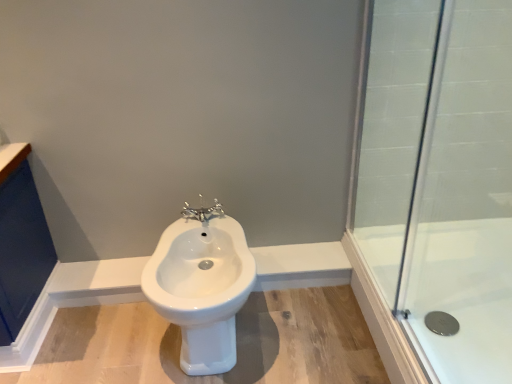
You are a GUI agent. You are given a task and a screenshot of the screen. Output one action in this format:
    pyautogui.click(x=<x>, y=<y>)
    Task: Click on the free space to the left of white glossy bidet at center
    The height and width of the screenshot is (384, 512).
    Given the screenshot: What is the action you would take?
    pyautogui.click(x=120, y=342)